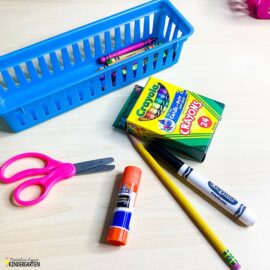
Identify the location of glue stick. (123, 198).